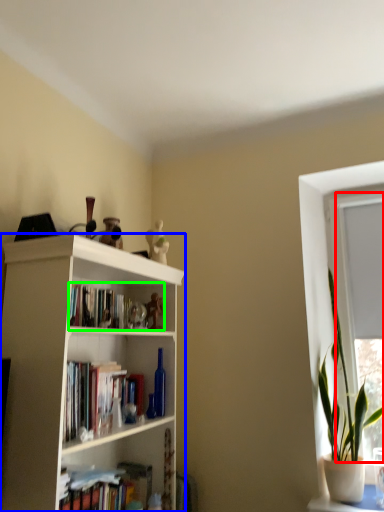
Question: Which object is positioned closest to window frame (highlighted by a red box)? Select from bookcase (highlighted by a blue box) and book (highlighted by a green box).

Choices:
 (A) bookcase
 (B) book

Answer: (B)